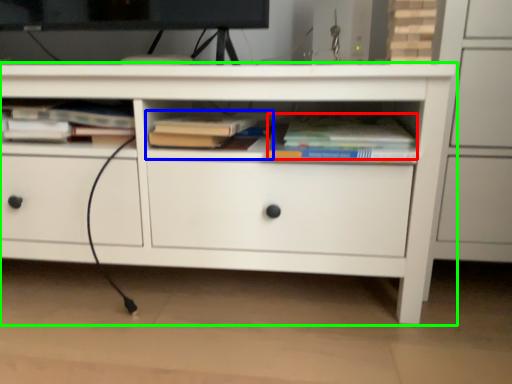
Question: Which is nearer to the book (highlighted by a red box)? book (highlighted by a blue box) or chest of drawers (highlighted by a green box).

Choices:
 (A) book
 (B) chest of drawers

Answer: (A)